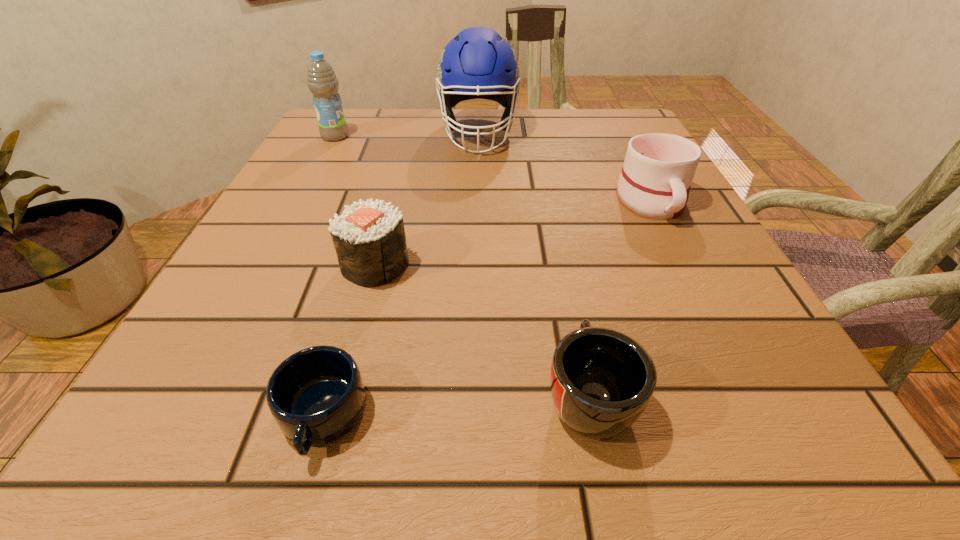
At what (x,y) coordinates should I click in order to perform the action: click on object that is at the far left corner. Please return your answer as a coordinate pair (x, y). Looking at the image, I should click on (322, 81).

In the image, there is a desktop. At what (x,y) coordinates should I click in order to perform the action: click on free space at the far edge. Please return your answer as a coordinate pair (x, y). The height and width of the screenshot is (540, 960). Looking at the image, I should click on (412, 150).

Identify the location of vacant position at the near edge of the desktop. (413, 465).

You are a GUI agent. You are given a task and a screenshot of the screen. Output one action in this format:
    pyautogui.click(x=<x>, y=<y>)
    Task: Click on the vacant space at the left edge
    This screenshot has height=540, width=960.
    Given the screenshot: What is the action you would take?
    pyautogui.click(x=271, y=345)

Find the location of `vacant space at the right edge`. vacant space at the right edge is located at coordinates (732, 355).

At what (x,y) coordinates should I click in order to perform the action: click on free spot at the near left corner of the desktop. Please return your answer as a coordinate pair (x, y). Looking at the image, I should click on (235, 402).

In the image, there is a desktop. Find the location of `vacant area at the far right corner`. vacant area at the far right corner is located at coordinates (629, 109).

Locate an element on the screen. The width and height of the screenshot is (960, 540). free region at the near right corner is located at coordinates (827, 460).

Where is `free space that is in between the tallest object and the farthest mug`? The height and width of the screenshot is (540, 960). free space that is in between the tallest object and the farthest mug is located at coordinates (565, 167).

The height and width of the screenshot is (540, 960). I want to click on vacant region between the farthest mug and the second tallest mug, so click(x=620, y=298).